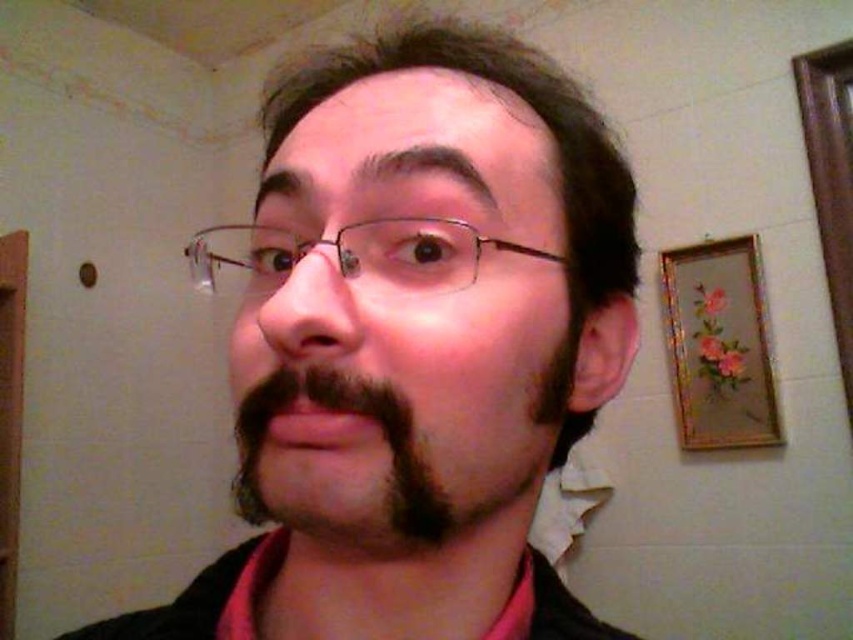
Question: Can you confirm if matte black hair at center is bigger than metallic wireframe glasses at center?

Choices:
 (A) no
 (B) yes

Answer: (B)

Question: Is matte black hair at center bigger than dark brown fuzzy beard at center?

Choices:
 (A) yes
 (B) no

Answer: (A)

Question: Which of the following is the closest to the observer?

Choices:
 (A) (280, 378)
 (B) (393, 376)

Answer: (B)

Question: Which point is farther to the camera?

Choices:
 (A) matte black hair at center
 (B) metallic wireframe glasses at center
 (C) dark brown fuzzy beard at center

Answer: (B)

Question: Which object is farther from the camera taking this photo?

Choices:
 (A) dark brown fuzzy beard at center
 (B) matte black hair at center

Answer: (A)

Question: Does dark brown fuzzy beard at center have a lesser width compared to metallic wireframe glasses at center?

Choices:
 (A) no
 (B) yes

Answer: (B)